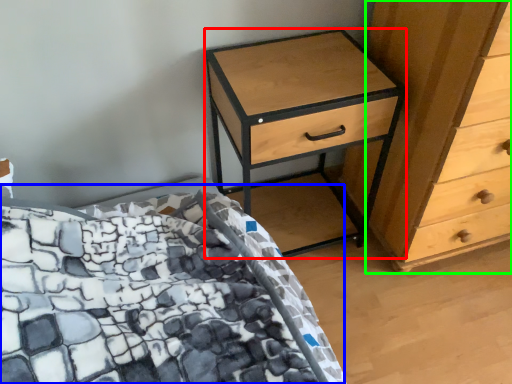
Question: Estimate the real-world distances between objects in this image. Which object is farther from nightstand (highlighted by a red box), bed (highlighted by a blue box) or chest of drawers (highlighted by a green box)?

Choices:
 (A) bed
 (B) chest of drawers

Answer: (A)